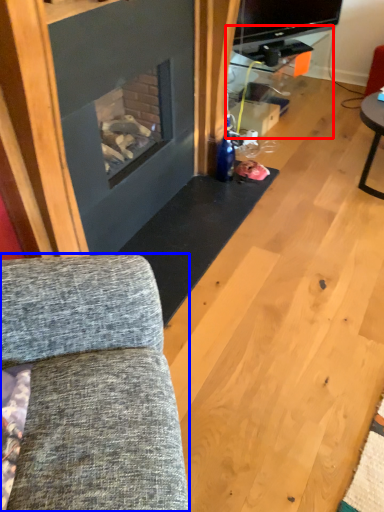
Question: Which object is further to the camera taking this photo, entertainment center (highlighted by a red box) or studio couch (highlighted by a blue box)?

Choices:
 (A) entertainment center
 (B) studio couch

Answer: (A)